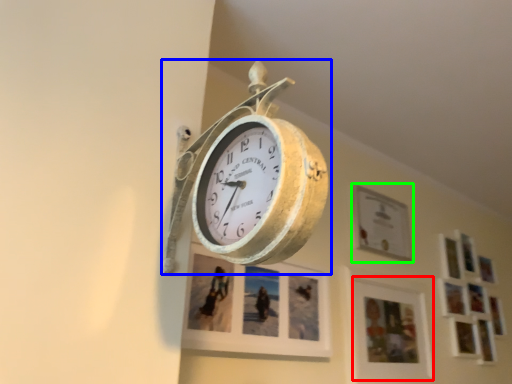
Question: Which object is the farthest from picture frame (highlighted by a red box)? Choose among these: wall clock (highlighted by a blue box) or picture frame (highlighted by a green box).

Choices:
 (A) wall clock
 (B) picture frame

Answer: (A)